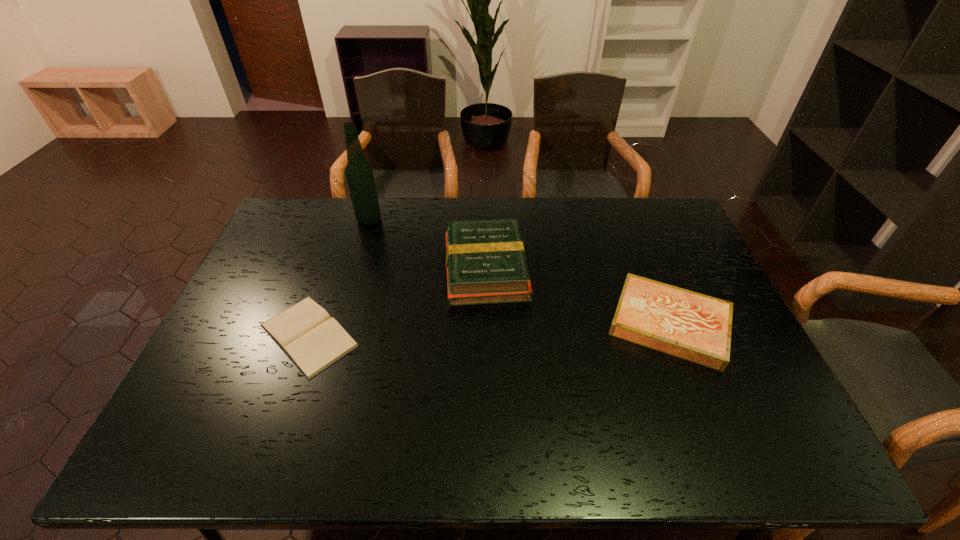
I want to click on free space at the near left corner of the desktop, so click(x=167, y=442).

This screenshot has height=540, width=960. In the image, there is a desktop. Find the location of `vacant space at the far right corner`. vacant space at the far right corner is located at coordinates (652, 234).

Identify the location of free space between the Bible and the left hardback book. This screenshot has height=540, width=960. (397, 302).

Identify the location of free point between the taller hardback book and the alcohol. (x=427, y=244).

This screenshot has height=540, width=960. What are the coordinates of `free space between the farthest object and the shortest object` in the screenshot? It's located at (339, 278).

Find the location of `unoccupied position between the taller hardback book and the alcohol`. unoccupied position between the taller hardback book and the alcohol is located at coordinates (427, 244).

The height and width of the screenshot is (540, 960). In order to click on free space between the taller hardback book and the tallest object in this screenshot , I will do `click(427, 244)`.

Where is `vacant space that is in between the tallest object and the Bible`? This screenshot has height=540, width=960. vacant space that is in between the tallest object and the Bible is located at coordinates (339, 278).

Find the location of `free space between the second shortest object and the Bible`. free space between the second shortest object and the Bible is located at coordinates (489, 329).

This screenshot has height=540, width=960. In order to click on vacant area that lies between the second object from right to left and the rightmost object in this screenshot , I will do `click(577, 296)`.